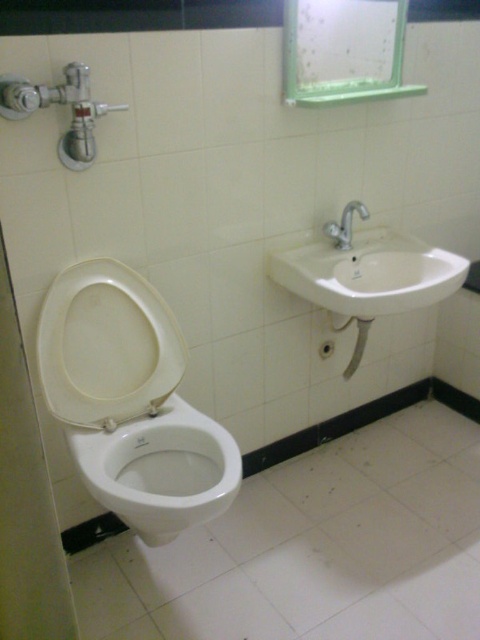
Looking at this image, who is positioned more to the right, white glossy bidet at lower left or white ceramic sink at upper right?

white ceramic sink at upper right

Is white glossy bidet at lower left to the left of white ceramic sink at upper right from the viewer's perspective?

Correct, you'll find white glossy bidet at lower left to the left of white ceramic sink at upper right.

Is point (117, 474) behind point (355, 276)?

That is False.

Where is `white glossy bidet at lower left`? white glossy bidet at lower left is located at coordinates (159, 468).

Which is in front, point (109, 428) or point (425, 285)?

Positioned in front is point (109, 428).

Between point (90, 344) and point (377, 259), which one is positioned behind?

Positioned behind is point (377, 259).

At what (x,y) coordinates should I click in order to perform the action: click on white matte toilet lid at center. Please return your answer as a coordinate pair (x, y). Looking at the image, I should click on (106, 346).

Locate an element on the screen. The image size is (480, 640). white matte toilet lid at center is located at coordinates click(x=106, y=346).

Who is higher up, white matte toilet lid at center or silver metallic faucet at upper right?

silver metallic faucet at upper right is above.

Where is `white matte toilet lid at center`? The height and width of the screenshot is (640, 480). white matte toilet lid at center is located at coordinates (106, 346).